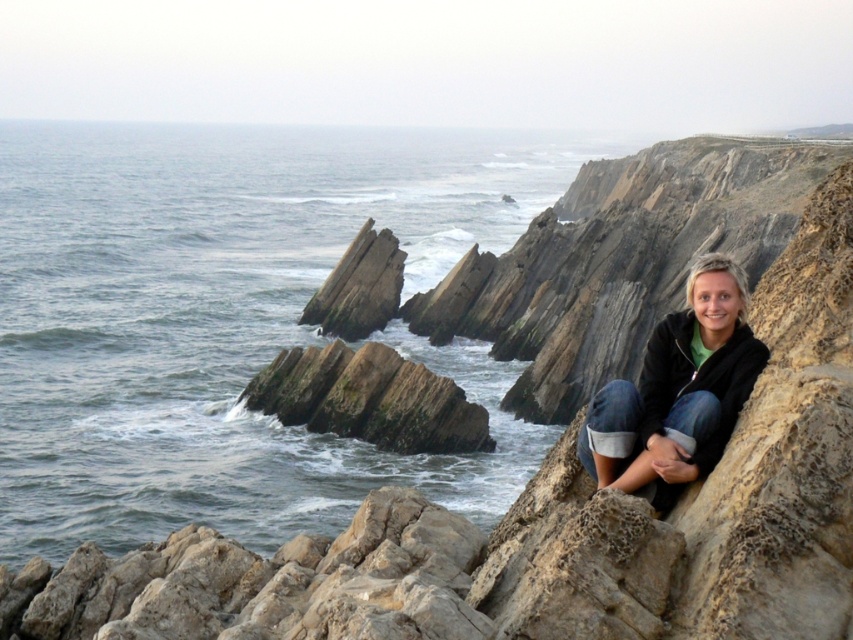
Question: Can you confirm if blue-green water at center is positioned to the left of denim jacket at lower right?

Choices:
 (A) no
 (B) yes

Answer: (B)

Question: Does blue-green water at center appear on the left side of denim jacket at lower right?

Choices:
 (A) yes
 (B) no

Answer: (A)

Question: Can you confirm if blue-green water at center is positioned above denim jacket at lower right?

Choices:
 (A) no
 (B) yes

Answer: (B)

Question: Which point is closer to the camera taking this photo?

Choices:
 (A) (117, 484)
 (B) (712, 314)

Answer: (B)

Question: Which object is farther from the camera taking this photo?

Choices:
 (A) denim jacket at lower right
 (B) blue-green water at center

Answer: (B)